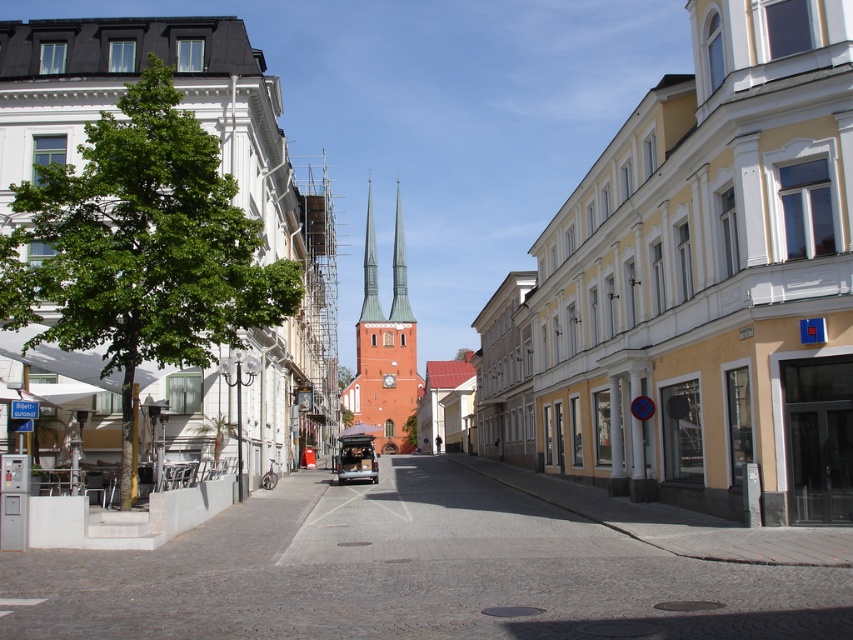
You are a tourist standing on the cobblestone street and want to take a photo of both the yellow painted building at right and the metallic silver van at center. Which object should you focus on first to ensure both are in the frame?

You should focus on the yellow painted building at right first because it is closer to you than the metallic silver van at center, so adjusting the camera to include both would require starting with the closer object.

You are a tourist standing at the end of the cobblestone street looking towards the buildings. You see the red brick spire at center and the metallic silver van at center. Which object is closer to the left side of the street?

The red brick spire at center is positioned on the left side of the metallic silver van at center, so it is closer to the left side of the street.

You are standing on the cobblestone street in front of the white building with a dark roof. You want to cross the street to reach the yellow painted building at right. Given that the street is 10 meters wide, can you safely cross without needing to walk further than the street width?

The yellow painted building at right is 17.92 meters away from you. Since the street is only 10 meters wide, you would need to walk an additional 7.92 meters beyond the street to reach the yellow painted building at right.